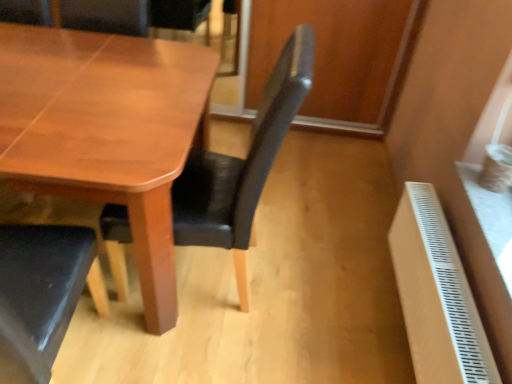
Question: Is satin black chair at center smaller than wooden table at center?

Choices:
 (A) yes
 (B) no

Answer: (A)

Question: Does satin black chair at center appear on the right side of wooden table at center?

Choices:
 (A) yes
 (B) no

Answer: (A)

Question: From a real-world perspective, is satin black chair at center below wooden table at center?

Choices:
 (A) no
 (B) yes

Answer: (A)

Question: Is satin black chair at center oriented towards wooden table at center?

Choices:
 (A) yes
 (B) no

Answer: (A)

Question: From the image's perspective, is satin black chair at center over wooden table at center?

Choices:
 (A) yes
 (B) no

Answer: (B)

Question: Is there a large distance between satin black chair at center and wooden table at center?

Choices:
 (A) yes
 (B) no

Answer: (B)

Question: Considering the relative sizes of satin black chair at center and white plastic radiator at lower right in the image provided, is satin black chair at center wider than white plastic radiator at lower right?

Choices:
 (A) no
 (B) yes

Answer: (B)

Question: Is satin black chair at center in front of white plastic radiator at lower right?

Choices:
 (A) yes
 (B) no

Answer: (A)

Question: Is satin black chair at center outside of white plastic radiator at lower right?

Choices:
 (A) no
 (B) yes

Answer: (B)

Question: Is satin black chair at center at the right side of white plastic radiator at lower right?

Choices:
 (A) no
 (B) yes

Answer: (A)

Question: From the image's perspective, is satin black chair at center below white plastic radiator at lower right?

Choices:
 (A) no
 (B) yes

Answer: (A)

Question: Could white plastic radiator at lower right be considered to be inside satin black chair at center?

Choices:
 (A) no
 (B) yes

Answer: (A)

Question: Is wooden table at center positioned beyond the bounds of satin black chair at center?

Choices:
 (A) no
 (B) yes

Answer: (B)